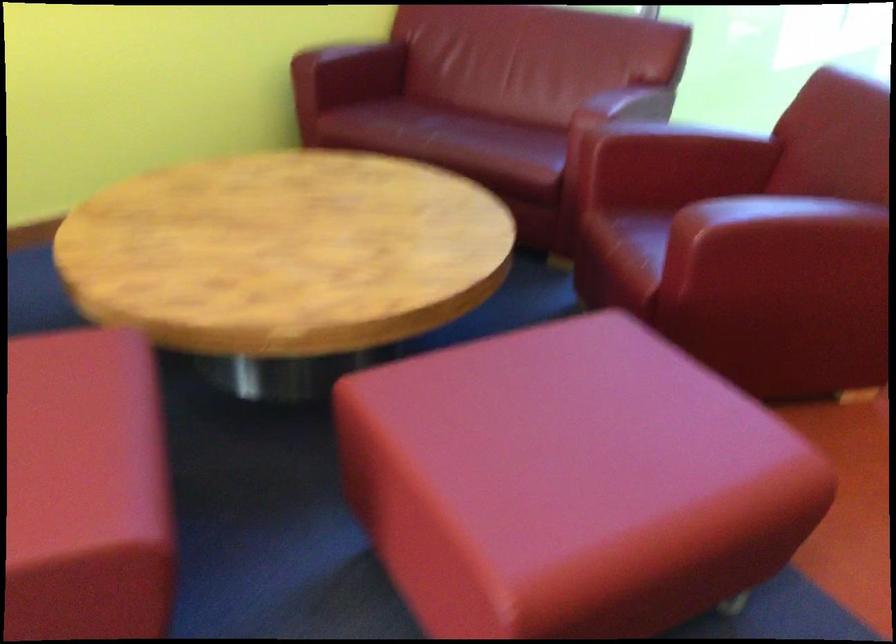
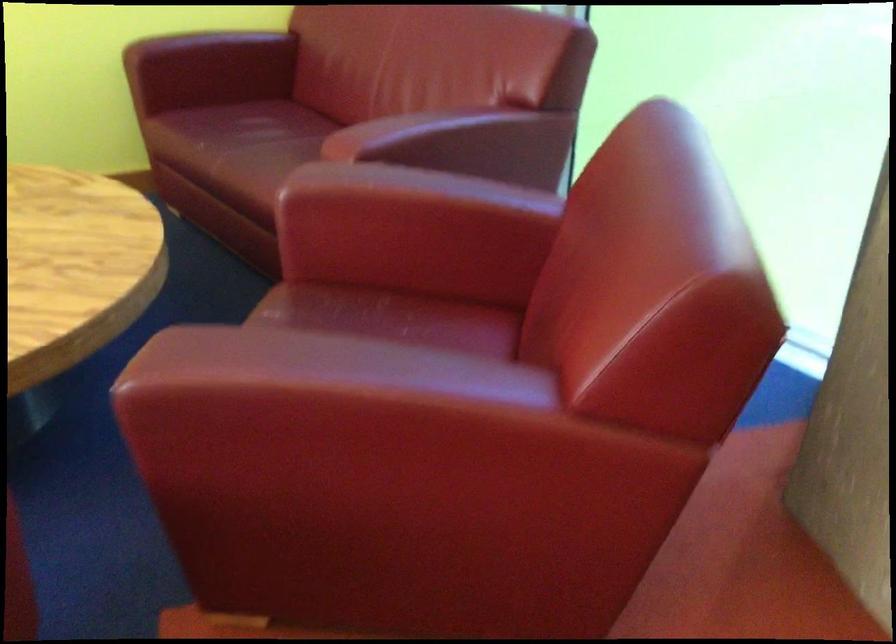
Locate, in the second image, the point that corresponds to the point at 432,117 in the first image.

(263, 131)